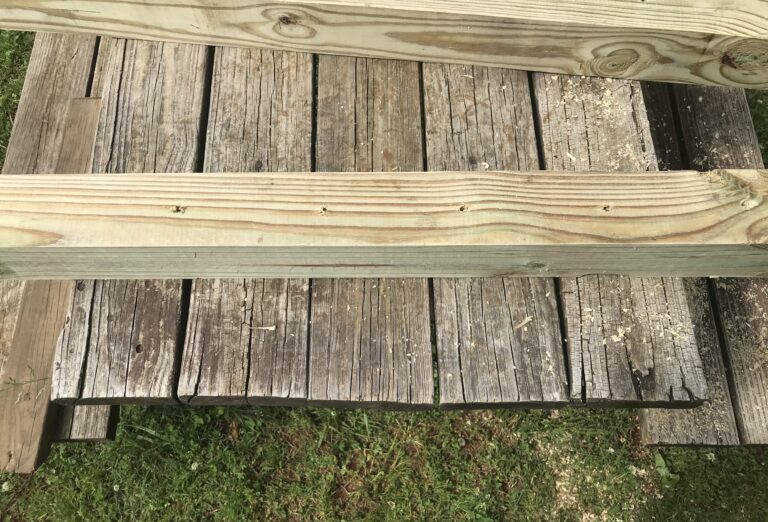
The height and width of the screenshot is (522, 768). Identify the location of vertical wood boards. (429, 106), (368, 112), (257, 108), (176, 98), (598, 151), (687, 130).